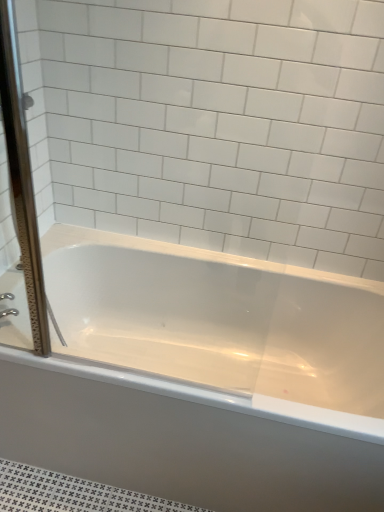
Question: Is clear glass screen door at left wider or thinner than silver metallic faucet at left?

Choices:
 (A) wide
 (B) thin

Answer: (A)

Question: Considering their positions, is clear glass screen door at left located in front of or behind silver metallic faucet at left?

Choices:
 (A) behind
 (B) front

Answer: (B)

Question: Considering the real-world distances, which object is closest to the clear glass screen door at left?

Choices:
 (A) white glossy bathtub at center
 (B) silver metallic faucet at left

Answer: (B)

Question: Which object is the farthest from the white glossy bathtub at center?

Choices:
 (A) silver metallic faucet at left
 (B) clear glass screen door at left

Answer: (A)